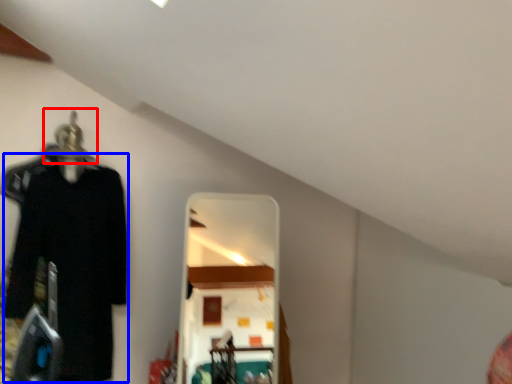
Question: Which of the following is the farthest to the observer, hanger (highlighted by a red box) or clothing (highlighted by a blue box)?

Choices:
 (A) hanger
 (B) clothing

Answer: (A)